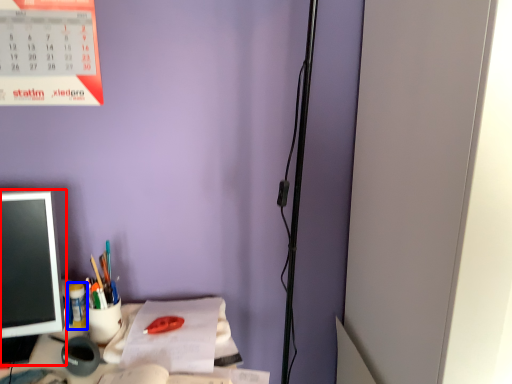
Question: Which point is further to the camera, office supplies (highlighted by a red box) or stationery (highlighted by a blue box)?

Choices:
 (A) office supplies
 (B) stationery

Answer: (B)